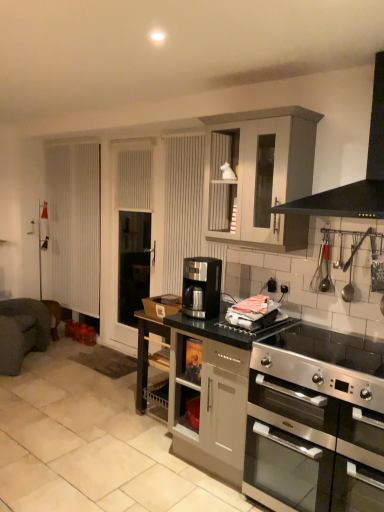
The width and height of the screenshot is (384, 512). What are the coordinates of `free space to the left of matte gray cabinet at center, which is counted as the 1th cabinetry, starting from the bottom` in the screenshot? It's located at (137, 467).